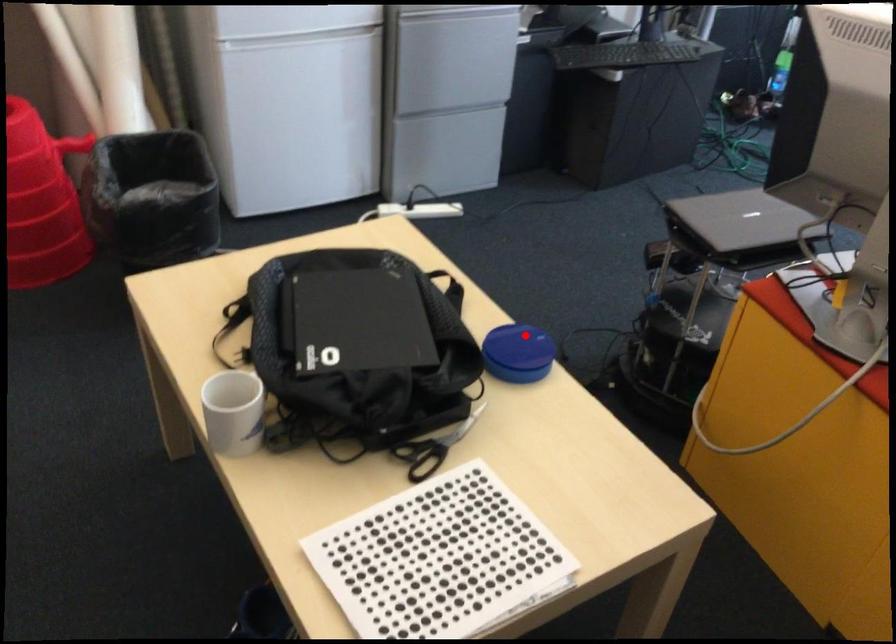
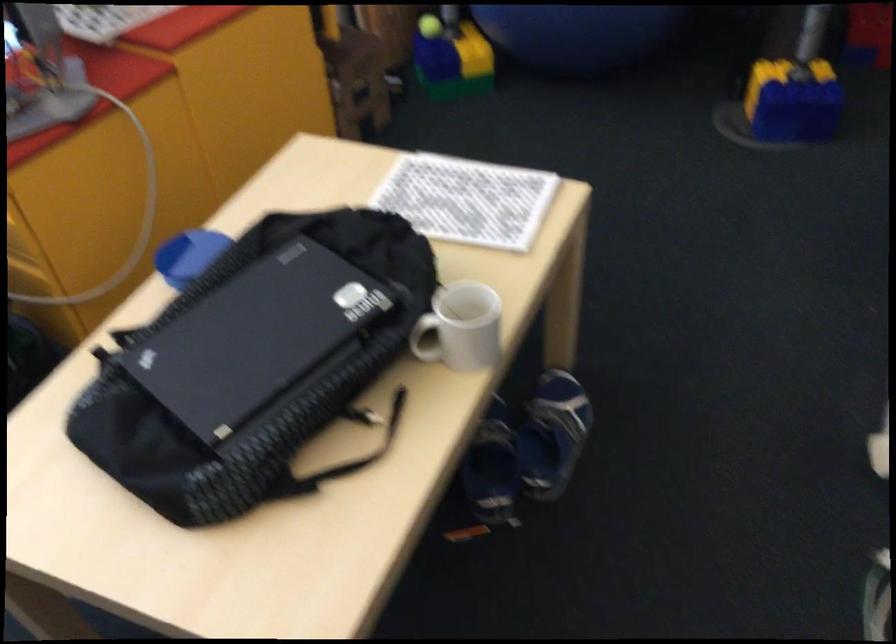
Question: I am providing you with two images of the same scene from different viewpoints. Image1 has a red point marked. In image2, the corresponding 3D location appears at what relative position? Reply with the corresponding letter.

Choices:
 (A) Closer
 (B) Farther

Answer: (A)